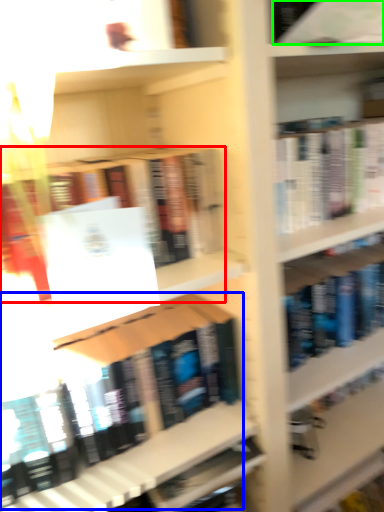
Question: Based on their relative distances, which object is nearer to book (highlighted by a red box)? Choose from book (highlighted by a blue box) and book (highlighted by a green box).

Choices:
 (A) book
 (B) book

Answer: (B)